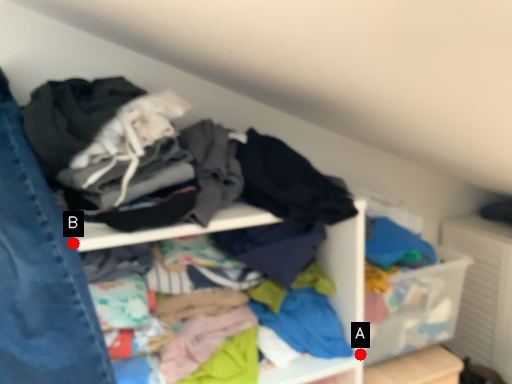
Question: Two points are circled on the image, labeled by A and B beside each circle. Which of the following is the closest to the observer?

Choices:
 (A) A is closer
 (B) B is closer

Answer: (B)